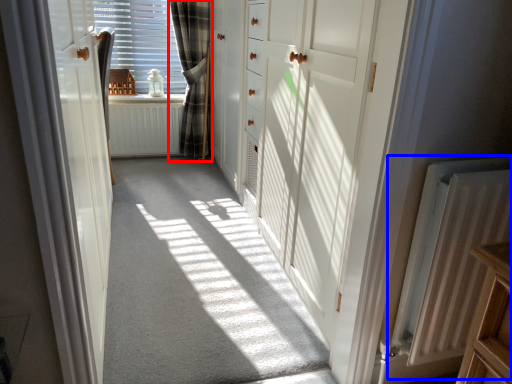
Question: Among these objects, which one is nearest to the camera, curtain (highlighted by a red box) or radiator (highlighted by a blue box)?

Choices:
 (A) curtain
 (B) radiator

Answer: (B)